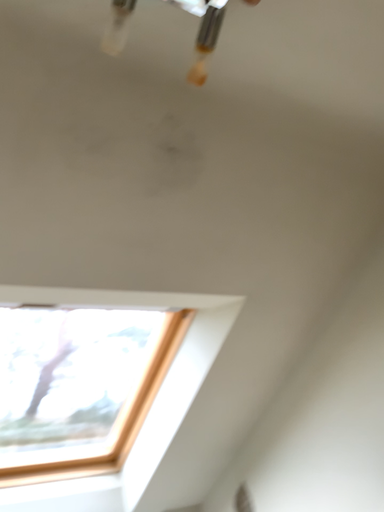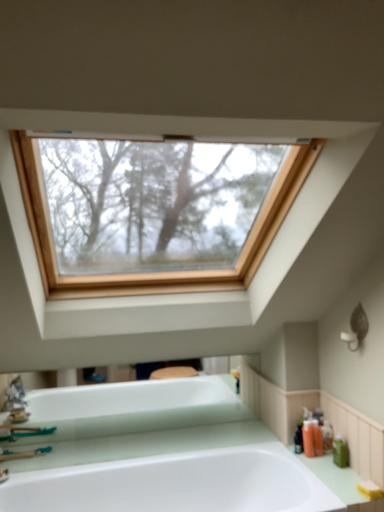
Question: How did the camera likely rotate when shooting the video?

Choices:
 (A) rotated right
 (B) rotated left

Answer: (B)